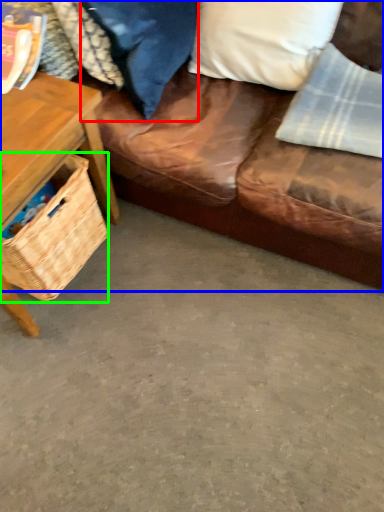
Question: Based on their relative distances, which object is nearer to pillow (highlighted by a red box)? Choose from studio couch (highlighted by a blue box) and picnic basket (highlighted by a green box).

Choices:
 (A) studio couch
 (B) picnic basket

Answer: (A)